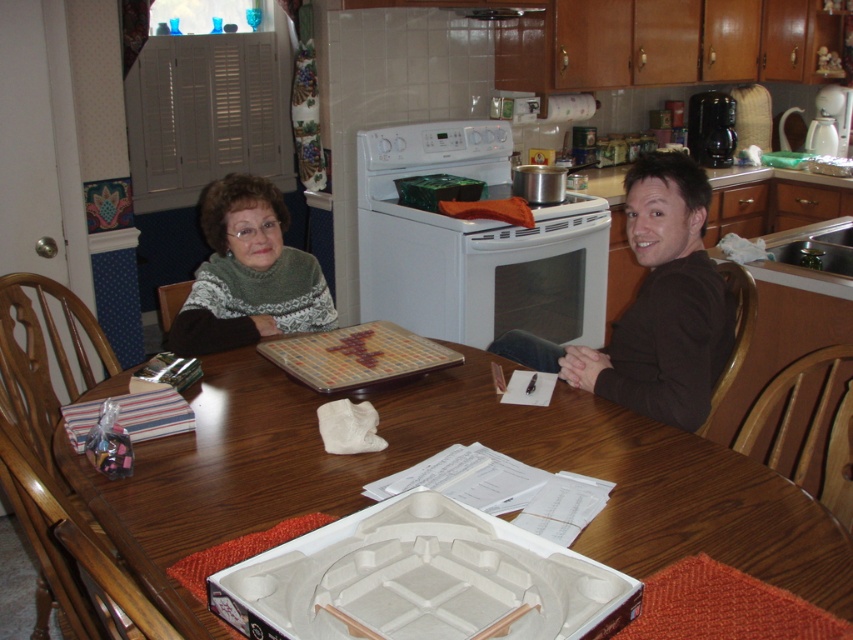
Looking at this image, which is below, wooden table at center or green knitted sweater at upper left?

wooden table at center

Is wooden table at center to the left of green knitted sweater at upper left from the viewer's perspective?

Incorrect, wooden table at center is not on the left side of green knitted sweater at upper left.

Locate an element on the screen. Image resolution: width=853 pixels, height=640 pixels. wooden table at center is located at coordinates (433, 452).

Who is more distant from viewer, (375, 195) or (216, 262)?

Positioned behind is point (375, 195).

Does white glossy stove at center lie behind green knitted sweater at upper left?

Yes, it is.

Locate an element on the screen. white glossy stove at center is located at coordinates (474, 244).

Is wooden table at center bigger than white glossy stove at center?

No, wooden table at center is not bigger than white glossy stove at center.

Can you confirm if wooden table at center is positioned above white glossy stove at center?

No, wooden table at center is not above white glossy stove at center.

Find the location of `wooden table at center`. wooden table at center is located at coordinates (433, 452).

Find the location of `wooden table at center`. wooden table at center is located at coordinates (433, 452).